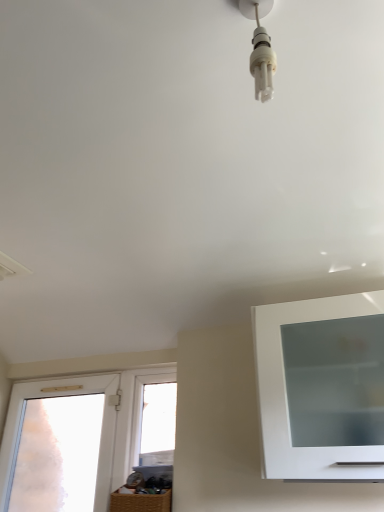
Identify the location of white plastic light bulb at upper center. (260, 48).

From a real-world perspective, is transparent frosted glass door at left, the first window in the left-to-right sequence, physically located above or below white plastic light bulb at upper center?

transparent frosted glass door at left, the first window in the left-to-right sequence, is below white plastic light bulb at upper center.

From the image's perspective, would you say transparent frosted glass door at left, the second window positioned from the right, is positioned over white plastic light bulb at upper center?

No, from the image's perspective, transparent frosted glass door at left, the second window positioned from the right, is not above white plastic light bulb at upper center.

From the picture: Are transparent frosted glass door at left, the second window positioned from the right, and white plastic light bulb at upper center beside each other?

There is a gap between transparent frosted glass door at left, the second window positioned from the right, and white plastic light bulb at upper center.

Is the depth of transparent frosted glass door at left, the second window positioned from the right, greater than that of white plastic light bulb at upper center?

Yes, transparent frosted glass door at left, the second window positioned from the right, is behind white plastic light bulb at upper center.

From the image's perspective, which one is positioned higher, white plastic light bulb at upper center or transparent glass window at center, which ranks as the 2th window in left-to-right order?

white plastic light bulb at upper center, from the image's perspective.

From a real-world perspective, relative to transparent glass window at center, the 1th window in the right-to-left sequence, is white plastic light bulb at upper center vertically above or below?

white plastic light bulb at upper center is above transparent glass window at center, the 1th window in the right-to-left sequence.

From the picture: Is transparent glass window at center, which ranks as the 2th window in left-to-right order, surrounded by white plastic light bulb at upper center?

No.

From the image's perspective, who appears lower, transparent glass window at center, which ranks as the 2th window in left-to-right order, or transparent frosted glass door at left, the first window in the left-to-right sequence?

transparent frosted glass door at left, the first window in the left-to-right sequence.

Is transparent glass window at center, the 1th window in the right-to-left sequence, bigger than transparent frosted glass door at left, the first window in the left-to-right sequence?

Actually, transparent glass window at center, the 1th window in the right-to-left sequence, might be smaller than transparent frosted glass door at left, the first window in the left-to-right sequence.

How many degrees apart are the facing directions of transparent glass window at center, the 1th window in the right-to-left sequence, and transparent frosted glass door at left, the second window positioned from the right?

0.000839 degrees separate the facing orientations of transparent glass window at center, the 1th window in the right-to-left sequence, and transparent frosted glass door at left, the second window positioned from the right.

Considering the sizes of transparent glass window at center, which ranks as the 2th window in left-to-right order, and transparent frosted glass door at left, the second window positioned from the right, in the image, is transparent glass window at center, which ranks as the 2th window in left-to-right order, taller or shorter than transparent frosted glass door at left, the second window positioned from the right,?

In the image, transparent glass window at center, which ranks as the 2th window in left-to-right order, appears to be shorter than transparent frosted glass door at left, the second window positioned from the right.

From a real-world perspective, does white plastic light bulb at upper center stand above transparent frosted glass door at left, the second window positioned from the right?

Yes, from a real-world perspective, white plastic light bulb at upper center is over transparent frosted glass door at left, the second window positioned from the right

Is white plastic light bulb at upper center in front of or behind transparent frosted glass door at left, the first window in the left-to-right sequence, in the image?

white plastic light bulb at upper center is in front of transparent frosted glass door at left, the first window in the left-to-right sequence.

Is white plastic light bulb at upper center aimed at transparent frosted glass door at left, the second window positioned from the right?

No, white plastic light bulb at upper center is not oriented towards transparent frosted glass door at left, the second window positioned from the right.

Does transparent glass window at center, the 1th window in the right-to-left sequence, come behind white plastic light bulb at upper center?

Yes, transparent glass window at center, the 1th window in the right-to-left sequence, is further from the camera.

Does transparent glass window at center, the 1th window in the right-to-left sequence, have a smaller size compared to white plastic light bulb at upper center?

No, transparent glass window at center, the 1th window in the right-to-left sequence, is not smaller than white plastic light bulb at upper center.

Considering the positions of objects transparent glass window at center, which ranks as the 2th window in left-to-right order, and white plastic light bulb at upper center in the image provided, who is more to the right, transparent glass window at center, which ranks as the 2th window in left-to-right order, or white plastic light bulb at upper center?

From the viewer's perspective, white plastic light bulb at upper center appears more on the right side.

You are a GUI agent. You are given a task and a screenshot of the screen. Output one action in this format:
    pyautogui.click(x=<x>, y=<y>)
    Task: Click on the window behind the transparent frosted glass door at left, the first window in the left-to-right sequence
    
    Given the screenshot: What is the action you would take?
    pyautogui.click(x=143, y=415)

Is point (115, 430) positioned in front of point (145, 380)?

Yes, point (115, 430) is in front of point (145, 380).

Is transparent frosted glass door at left, the second window positioned from the right, inside or outside of transparent glass window at center, the 1th window in the right-to-left sequence?

transparent frosted glass door at left, the second window positioned from the right, is outside transparent glass window at center, the 1th window in the right-to-left sequence.

Is transparent frosted glass door at left, the second window positioned from the right, aimed at transparent glass window at center, which ranks as the 2th window in left-to-right order?

No, transparent frosted glass door at left, the second window positioned from the right, is not oriented towards transparent glass window at center, which ranks as the 2th window in left-to-right order.

Find the location of `light fixture above the transparent frosted glass door at left, the second window positioned from the right (from the image's perspective)`. light fixture above the transparent frosted glass door at left, the second window positioned from the right (from the image's perspective) is located at coordinates (260, 48).

Image resolution: width=384 pixels, height=512 pixels. Identify the location of light fixture that appears in front of the transparent glass window at center, the 1th window in the right-to-left sequence. (260, 48).

When comparing their distances from transparent frosted glass door at left, the first window in the left-to-right sequence, does white plastic light bulb at upper center or transparent glass window at center, the 1th window in the right-to-left sequence, seem closer?

transparent glass window at center, the 1th window in the right-to-left sequence.

Considering their positions, is transparent glass window at center, which ranks as the 2th window in left-to-right order, positioned further to transparent frosted glass door at left, the first window in the left-to-right sequence, than white plastic light bulb at upper center?

Among the two, white plastic light bulb at upper center is located further to transparent frosted glass door at left, the first window in the left-to-right sequence.

Consider the image. Estimate the real-world distances between objects in this image. Which object is closer to transparent glass window at center, which ranks as the 2th window in left-to-right order, transparent frosted glass door at left, the first window in the left-to-right sequence, or white plastic light bulb at upper center?

Based on the image, transparent frosted glass door at left, the first window in the left-to-right sequence, appears to be nearer to transparent glass window at center, which ranks as the 2th window in left-to-right order.

Considering their positions, is white plastic light bulb at upper center positioned further to transparent glass window at center, the 1th window in the right-to-left sequence, than transparent frosted glass door at left, the first window in the left-to-right sequence?

white plastic light bulb at upper center lies further to transparent glass window at center, the 1th window in the right-to-left sequence, than the other object.

Based on their spatial positions, is transparent glass window at center, which ranks as the 2th window in left-to-right order, or transparent frosted glass door at left, the first window in the left-to-right sequence, closer to white plastic light bulb at upper center?

transparent glass window at center, which ranks as the 2th window in left-to-right order, lies closer to white plastic light bulb at upper center than the other object.

From the picture: Estimate the real-world distances between objects in this image. Which object is closer to white plastic light bulb at upper center, transparent frosted glass door at left, the first window in the left-to-right sequence, or transparent glass window at center, the 1th window in the right-to-left sequence?

transparent glass window at center, the 1th window in the right-to-left sequence, is closer to white plastic light bulb at upper center.

Identify the location of window between white plastic light bulb at upper center and transparent glass window at center, which ranks as the 2th window in left-to-right order, along the z-axis. (102, 423).